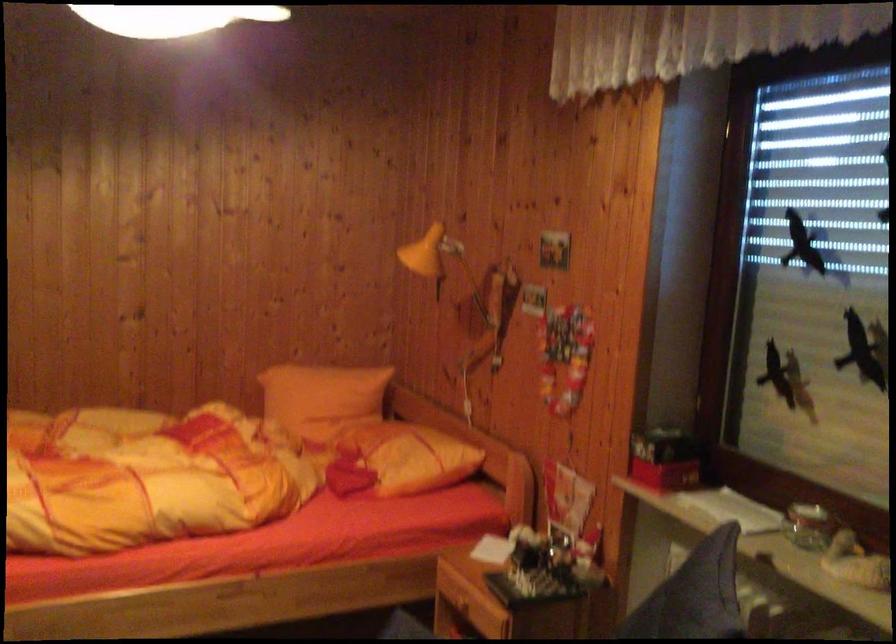
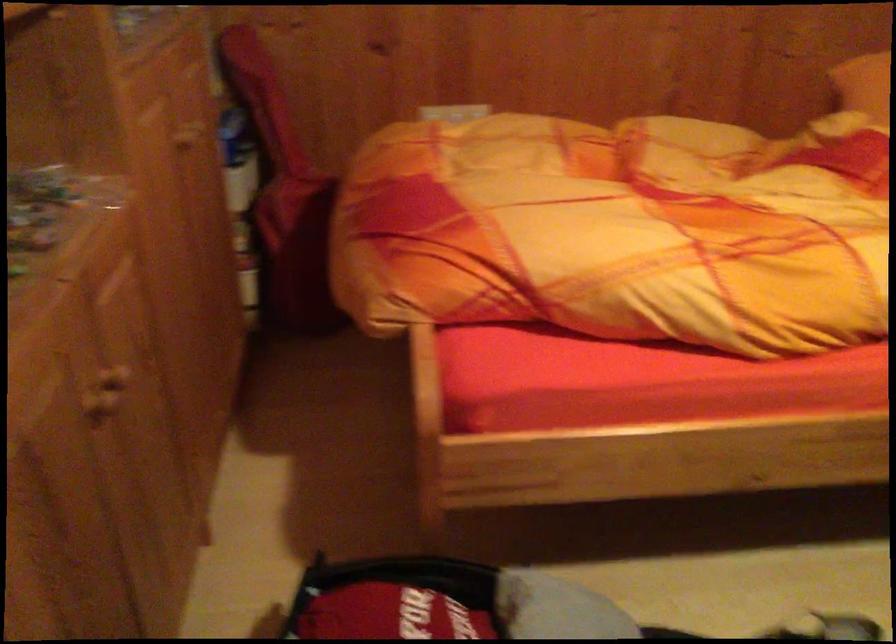
In a continuous first-person perspective shot, in which direction is the camera moving?

The cameraman moved toward left, forward.